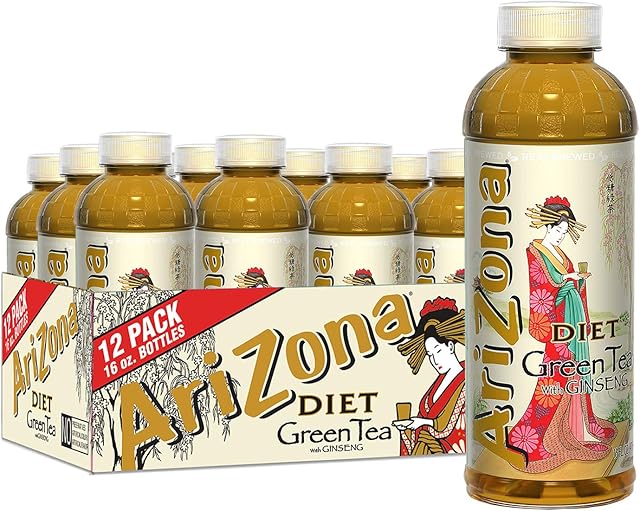
Image resolution: width=640 pixels, height=511 pixels. Find the location of `bottle`. bottle is located at coordinates (27, 210), (52, 204), (118, 213), (196, 178), (262, 178), (393, 211), (305, 183), (408, 188), (447, 197), (547, 185).